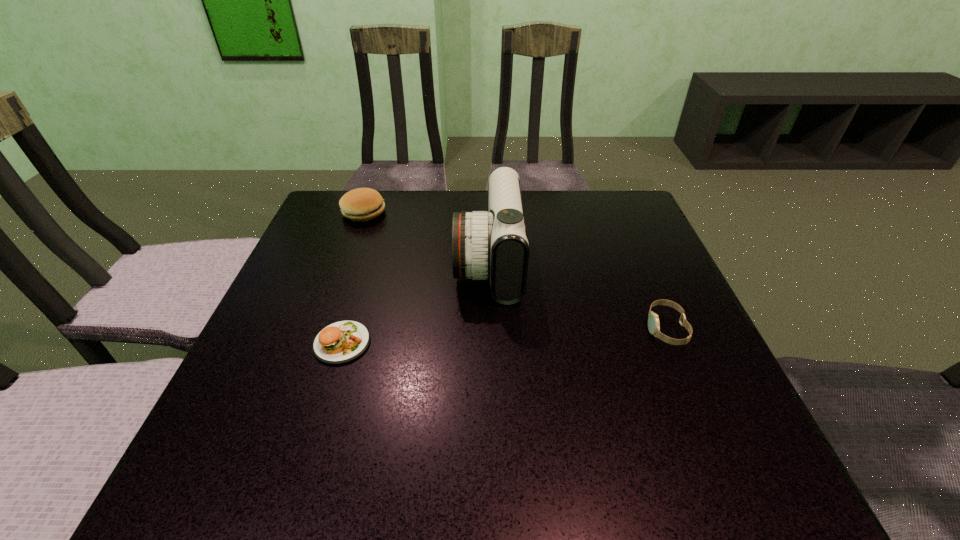
The image size is (960, 540). I want to click on free space between the farthest object and the tallest object, so click(x=426, y=238).

This screenshot has width=960, height=540. I want to click on empty location between the camcorder and the watch, so click(577, 295).

You are a GUI agent. You are given a task and a screenshot of the screen. Output one action in this format:
    pyautogui.click(x=<x>, y=<y>)
    Task: Click on the free space between the farthest object and the third nearest object
    
    Given the screenshot: What is the action you would take?
    pyautogui.click(x=426, y=238)

The image size is (960, 540). I want to click on empty space between the shorter patty and the third object from left to right, so click(416, 302).

Find the location of a particular element. The height and width of the screenshot is (540, 960). unoccupied position between the nearer patty and the camcorder is located at coordinates (416, 302).

Identify which object is the third closest to the farther patty. Please provide its 2D coordinates. Your answer should be formatted as a tuple, i.e. [(x, y)], where the tuple contains the x and y coordinates of a point satisfying the conditions above.

[(653, 321)]

In order to click on the third closest object to the shorter patty in this screenshot , I will do `click(653, 321)`.

Find the location of a particular element. free space that satisfies the following two spatial constraints: 1. on the face of the rightmost object; 2. on the front side of the nearer patty is located at coordinates (672, 342).

You are a GUI agent. You are given a task and a screenshot of the screen. Output one action in this format:
    pyautogui.click(x=<x>, y=<y>)
    Task: Click on the free region that satisfies the following two spatial constraints: 1. on the front side of the taller patty; 2. on the left side of the shorter patty
    The image size is (960, 540).
    Given the screenshot: What is the action you would take?
    pyautogui.click(x=316, y=342)